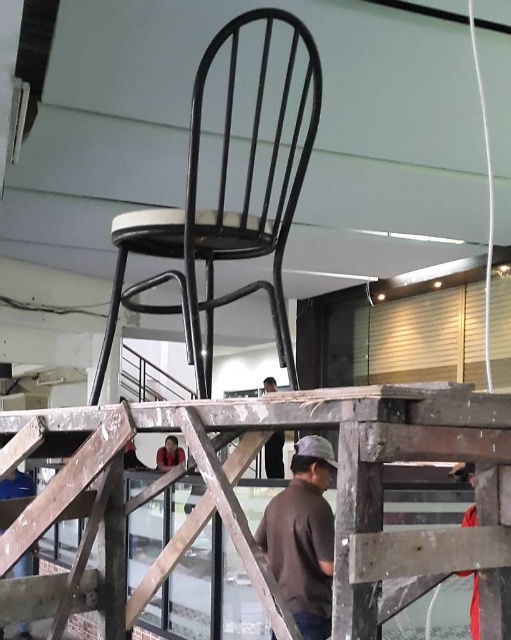
Does wooden at center appear over black metal chair at center?

Incorrect, wooden at center is not positioned above black metal chair at center.

Can you confirm if wooden at center is positioned to the left of black metal chair at center?

Correct, you'll find wooden at center to the left of black metal chair at center.

Describe the element at coordinates (249, 461) in the screenshot. I see `wooden at center` at that location.

The width and height of the screenshot is (511, 640). In order to click on wooden at center in this screenshot , I will do `click(249, 461)`.

Which is in front, point (412, 570) or point (269, 550)?

Point (412, 570) is in front.

Who is positioned more to the left, wooden at center or brown cotton shirt at lower center?

Positioned to the left is wooden at center.

What do you see at coordinates (249, 461) in the screenshot? The width and height of the screenshot is (511, 640). I see `wooden at center` at bounding box center [249, 461].

I want to click on wooden at center, so click(249, 461).

Can you confirm if black metal chair at center is smaller than brown cotton shirt at lower center?

Actually, black metal chair at center might be larger than brown cotton shirt at lower center.

Does black metal chair at center have a larger size compared to brown cotton shirt at lower center?

Yes.

Locate an element on the screen. black metal chair at center is located at coordinates (221, 209).